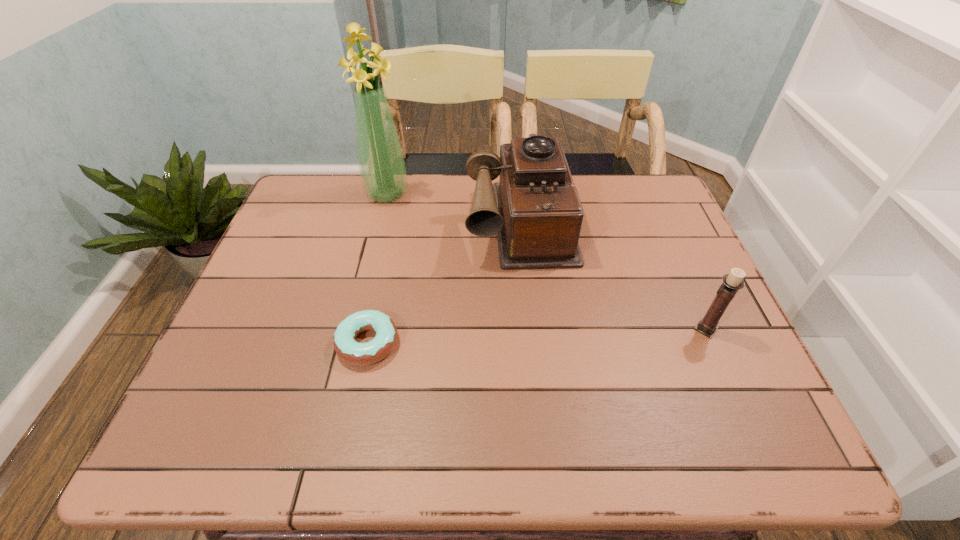
Image resolution: width=960 pixels, height=540 pixels. Find the location of `vacant space on the desktop that is between the shortest object and the rightmost object and is positioned on the front-facing side of the tallest object`. vacant space on the desktop that is between the shortest object and the rightmost object and is positioned on the front-facing side of the tallest object is located at coordinates (502, 338).

Identify the location of vacant spot on the desktop that is between the shortest object and the third tallest object and is positioned on the horn of the third object from left to right. The image size is (960, 540). (538, 336).